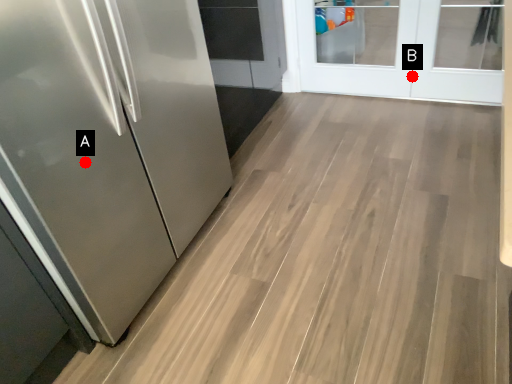
Question: Two points are circled on the image, labeled by A and B beside each circle. Among these points, which one is farthest from the camera?

Choices:
 (A) A is further
 (B) B is further

Answer: (B)